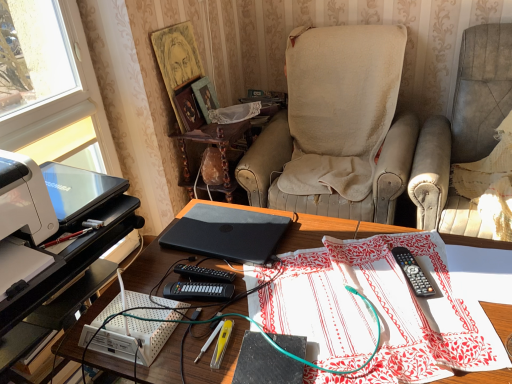
In order to click on vacant space to the right of black plastic remote control at center, acting as the 2th stationery starting from the left in this screenshot , I will do `click(441, 270)`.